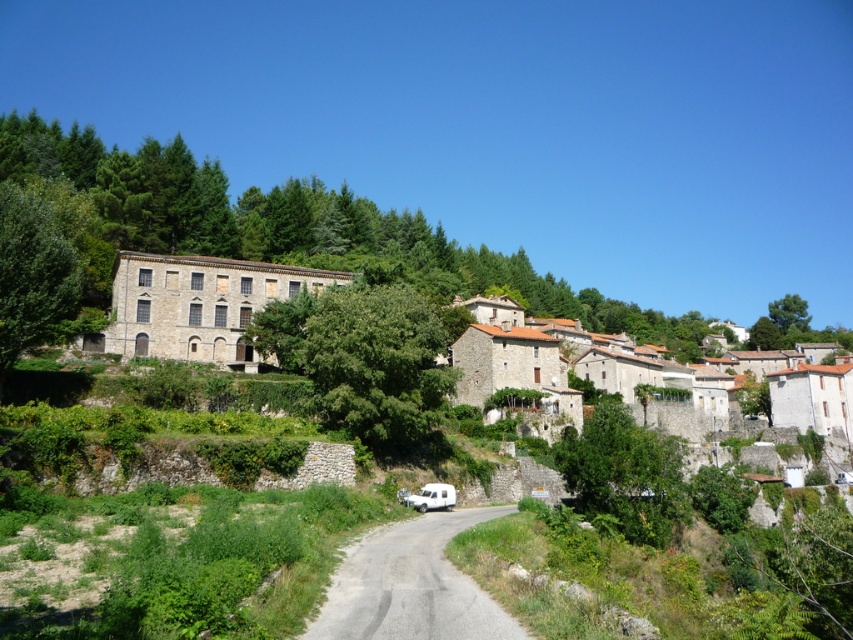
You are a cyclist planning to ride along the gray asphalt road at center. There is a green leafy tree at left overhead. Do you think the road is shaded by the tree?

The gray asphalt road at center is positioned under the green leafy tree at left, so the road is shaded by the tree.

You are driving a car and want to park near the gray asphalt road at center and the green leafy tree at left. Which object is closer to your current position?

The gray asphalt road at center is closer to the viewer than the green leafy tree at left, so the gray asphalt road at center is closer to your current position.

You are a hiker who wants to take a photo of both the green leafy tree at center and the green leafy tree at left in the same frame. Which tree should you move closer to in order to include both trees in your photo?

You should move closer to the green leafy tree at left because it is smaller than the green leafy tree at center. By moving closer to the smaller tree, you can better frame both trees within the camera view.